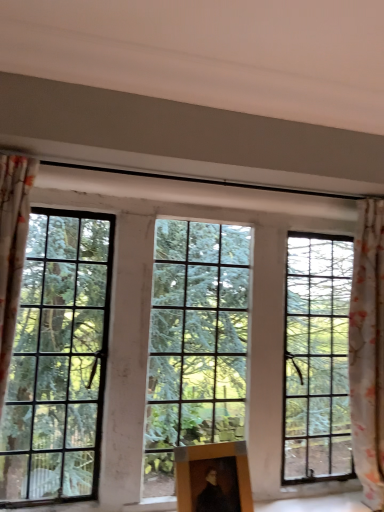
Question: Considering the relative positions of floral fabric curtain at right and clear glass window at center in the image provided, is floral fabric curtain at right to the left of clear glass window at center from the viewer's perspective?

Choices:
 (A) yes
 (B) no

Answer: (B)

Question: Could you tell me if floral fabric curtain at right is facing clear glass window at center?

Choices:
 (A) no
 (B) yes

Answer: (A)

Question: Considering the relative sizes of floral fabric curtain at right and clear glass window at center in the image provided, is floral fabric curtain at right smaller than clear glass window at center?

Choices:
 (A) yes
 (B) no

Answer: (A)

Question: Does floral fabric curtain at right touch clear glass window at center?

Choices:
 (A) yes
 (B) no

Answer: (B)

Question: From the image's perspective, is floral fabric curtain at right located above clear glass window at center?

Choices:
 (A) no
 (B) yes

Answer: (A)

Question: Is point (299, 226) closer or farther from the camera than point (382, 436)?

Choices:
 (A) closer
 (B) farther

Answer: (B)

Question: Considering the positions of clear glass window at center and floral fabric curtain at right in the image, is clear glass window at center taller or shorter than floral fabric curtain at right?

Choices:
 (A) tall
 (B) short

Answer: (B)

Question: Is clear glass window at center bigger or smaller than floral fabric curtain at right?

Choices:
 (A) small
 (B) big

Answer: (B)

Question: In terms of width, does clear glass window at center look wider or thinner when compared to floral fabric curtain at right?

Choices:
 (A) wide
 (B) thin

Answer: (B)

Question: In terms of height, does wooden picture frame at center look taller or shorter compared to clear glass window at center?

Choices:
 (A) tall
 (B) short

Answer: (B)

Question: Is wooden picture frame at center bigger or smaller than clear glass window at center?

Choices:
 (A) small
 (B) big

Answer: (A)

Question: From the image's perspective, is wooden picture frame at center positioned above or below clear glass window at center?

Choices:
 (A) above
 (B) below

Answer: (B)

Question: Do you think wooden picture frame at center is within clear glass window at center, or outside of it?

Choices:
 (A) outside
 (B) inside

Answer: (A)

Question: Is point (357, 433) closer or farther from the camera than point (218, 493)?

Choices:
 (A) farther
 (B) closer

Answer: (A)

Question: Choose the correct answer: Is floral fabric curtain at right inside wooden picture frame at center or outside it?

Choices:
 (A) inside
 (B) outside

Answer: (B)